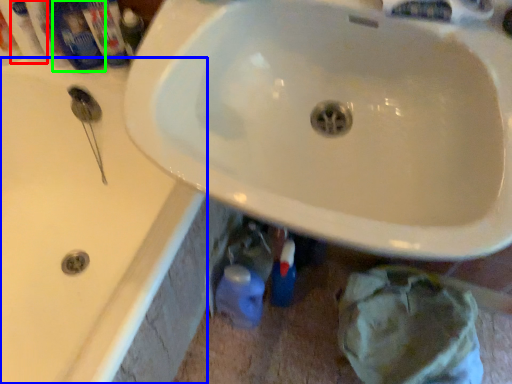
Question: Which is farther away from mouthwash (highlighted by a red box)? bath (highlighted by a blue box) or mouthwash (highlighted by a green box)?

Choices:
 (A) bath
 (B) mouthwash

Answer: (A)